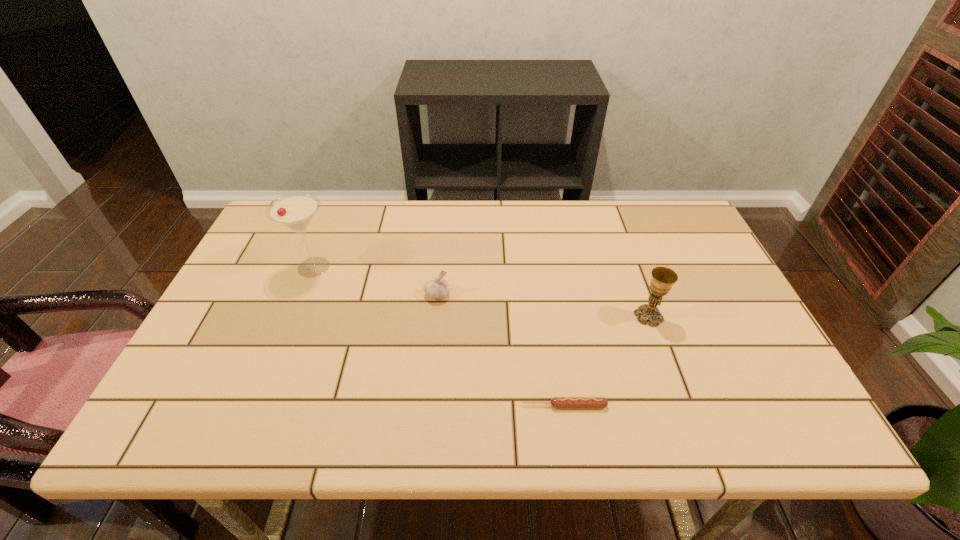
This screenshot has height=540, width=960. I want to click on object that is the closest to the second nearest object, so click(x=556, y=402).

Where is `free spot that satisfies the following two spatial constraints: 1. on the front side of the second tallest object; 2. on the left side of the second farthest object`? Image resolution: width=960 pixels, height=540 pixels. free spot that satisfies the following two spatial constraints: 1. on the front side of the second tallest object; 2. on the left side of the second farthest object is located at coordinates (x=435, y=316).

At what (x,y) coordinates should I click in order to perform the action: click on free space that satisfies the following two spatial constraints: 1. on the front side of the farthest object; 2. on the left side of the rightmost object. Please return your answer as a coordinate pair (x, y). Image resolution: width=960 pixels, height=540 pixels. Looking at the image, I should click on (294, 316).

The height and width of the screenshot is (540, 960). I want to click on vacant area in the image that satisfies the following two spatial constraints: 1. on the front side of the second shortest object; 2. on the left side of the martini, so [x=302, y=294].

What are the coordinates of `free spot that satisfies the following two spatial constraints: 1. on the front side of the rightmost object; 2. on the right side of the farthest object` in the screenshot? It's located at (294, 316).